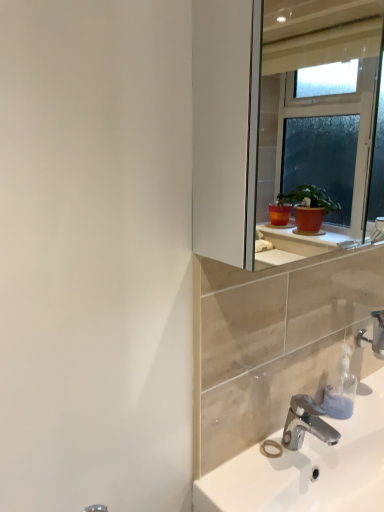
The image size is (384, 512). Identify the location of vacant area located to the right-hand side of chrome metallic faucet at lower right, which ranks as the first tap in front-to-back order. (349, 435).